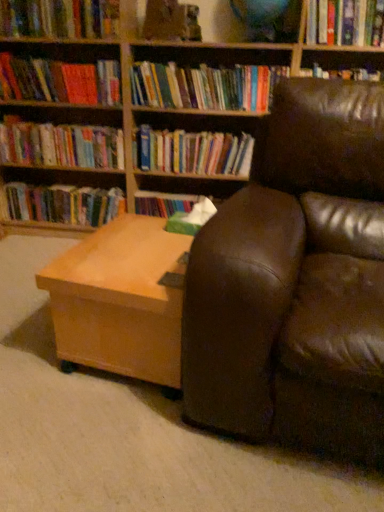
Question: Is there a large distance between hardcover book at upper left, arranged as the sixth book when ordered from the bottom, and brown leather couch at right?

Choices:
 (A) yes
 (B) no

Answer: (A)

Question: From a real-world perspective, is hardcover book at upper left, arranged as the sixth book when ordered from the bottom, positioned over brown leather couch at right based on gravity?

Choices:
 (A) yes
 (B) no

Answer: (A)

Question: Is the position of hardcover book at upper left, arranged as the 3th book when viewed from the top, more distant than that of brown leather couch at right?

Choices:
 (A) yes
 (B) no

Answer: (A)

Question: Does hardcover book at upper left, arranged as the 3th book when viewed from the top, touch brown leather couch at right?

Choices:
 (A) yes
 (B) no

Answer: (B)

Question: Does hardcover book at upper left, arranged as the sixth book when ordered from the bottom, turn towards brown leather couch at right?

Choices:
 (A) yes
 (B) no

Answer: (B)

Question: Does hardcover book at upper left, arranged as the 3th book when viewed from the top, appear on the left side of brown leather couch at right?

Choices:
 (A) no
 (B) yes

Answer: (B)

Question: Is hardcover book at upper right, the 4th book positioned from the top, turned away from hardcover books at left, which appears as the 3th book when ordered from the bottom?

Choices:
 (A) no
 (B) yes

Answer: (A)

Question: Can you confirm if hardcover book at upper right, the 4th book positioned from the top, is bigger than hardcover books at left, which appears as the 3th book when ordered from the bottom?

Choices:
 (A) yes
 (B) no

Answer: (B)

Question: Does hardcover book at upper right, the 4th book positioned from the top, have a smaller size compared to hardcover books at left, which is the 6th book from top to bottom?

Choices:
 (A) yes
 (B) no

Answer: (A)

Question: Is hardcover book at upper right, the 4th book positioned from the top, far away from hardcover books at left, which appears as the 3th book when ordered from the bottom?

Choices:
 (A) yes
 (B) no

Answer: (A)

Question: Considering the relative sizes of hardcover book at upper right, the 4th book positioned from the top, and hardcover books at left, which is the 6th book from top to bottom, in the image provided, is hardcover book at upper right, the 4th book positioned from the top, shorter than hardcover books at left, which is the 6th book from top to bottom,?

Choices:
 (A) yes
 (B) no

Answer: (A)

Question: Can you confirm if hardcover book at upper right, which appears as the fifth book when ordered from the bottom, is thinner than hardcover books at left, which appears as the 3th book when ordered from the bottom?

Choices:
 (A) no
 (B) yes

Answer: (A)

Question: Considering the relative sizes of brown leather couch at right and hardcover book at upper left, arranged as the 3th book when viewed from the top, in the image provided, is brown leather couch at right taller than hardcover book at upper left, arranged as the 3th book when viewed from the top,?

Choices:
 (A) yes
 (B) no

Answer: (A)